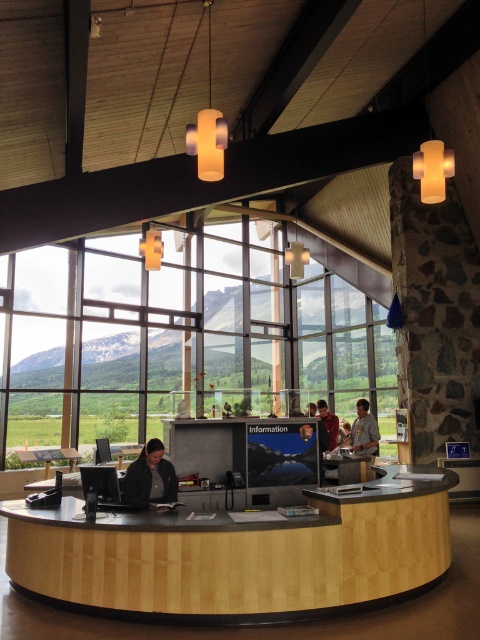
You are a visitor standing in front of the wooden reception desk at center. You want to look outside through the transparent glass window at center. Can you see the mountain view through the window?

The transparent glass window at center is positioned under the wooden reception desk at center, so you can look down to see the mountain view through the transparent glass window at center.

You are a visitor standing in front of the wooden reception desk at center and the matte black monitor at center. Which object is positioned to the left?

The matte black monitor at center is positioned to the left of the wooden reception desk at center.

You are standing at the entrance of the visitor center and want to approach the wooden reception desk at center. According to the image, in which direction should you move relative to your current position?

The wooden reception desk at center is located at point 0.867 on the x axis and 0.500 on the y axis. Since you are at the entrance, which is likely positioned at the lower left corner of the image, you should move towards the right to reach the wooden reception desk at center.